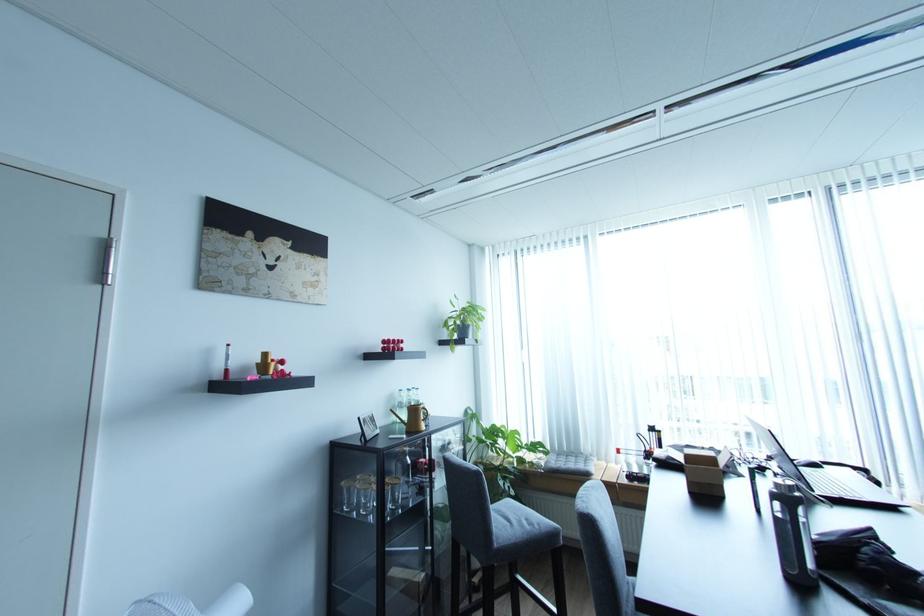
The location [399,411] corresponds to which object?

It corresponds to the clear water bottle in the image.